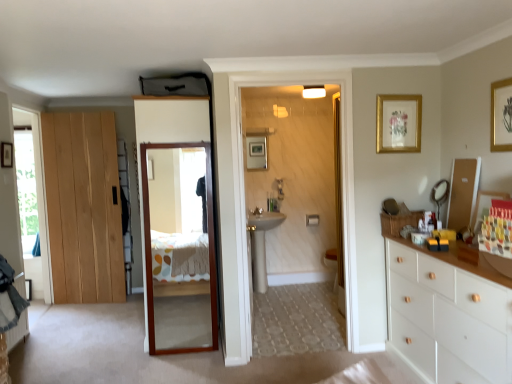
Where is `blank space above light wood door at left, which is the 2th door in right-to-left order (from a real-world perspective)`? blank space above light wood door at left, which is the 2th door in right-to-left order (from a real-world perspective) is located at coordinates (76, 115).